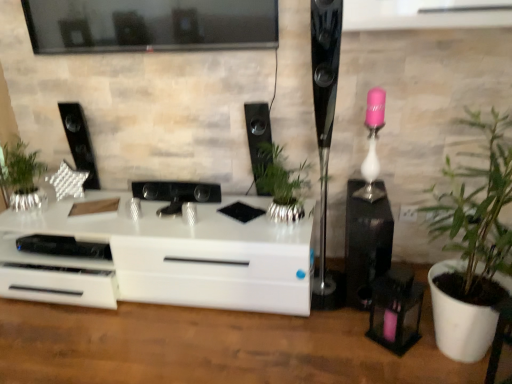
I want to click on free space that is in between white glossy chest of drawers at center and polished black speaker at right, acting as the second speaker starting from the right, so click(x=323, y=303).